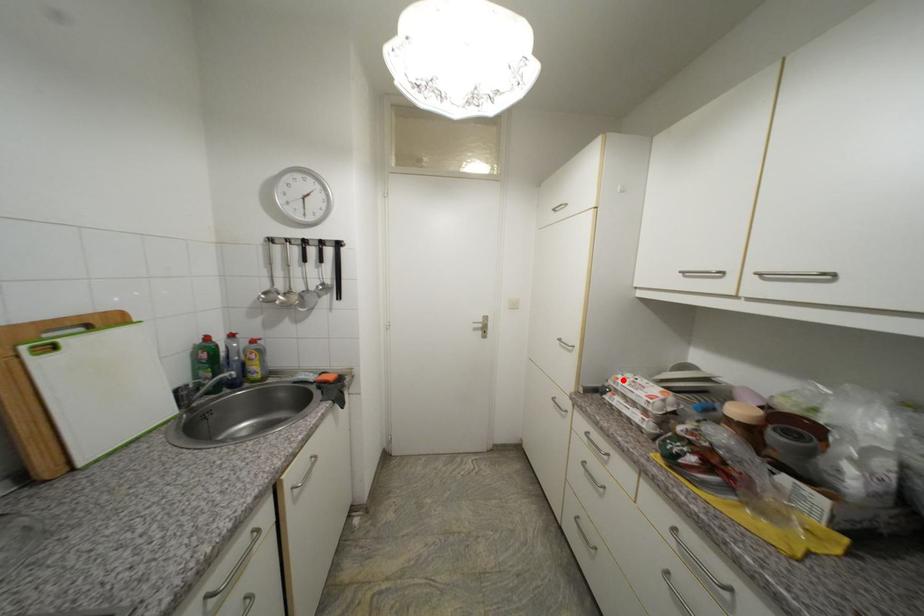
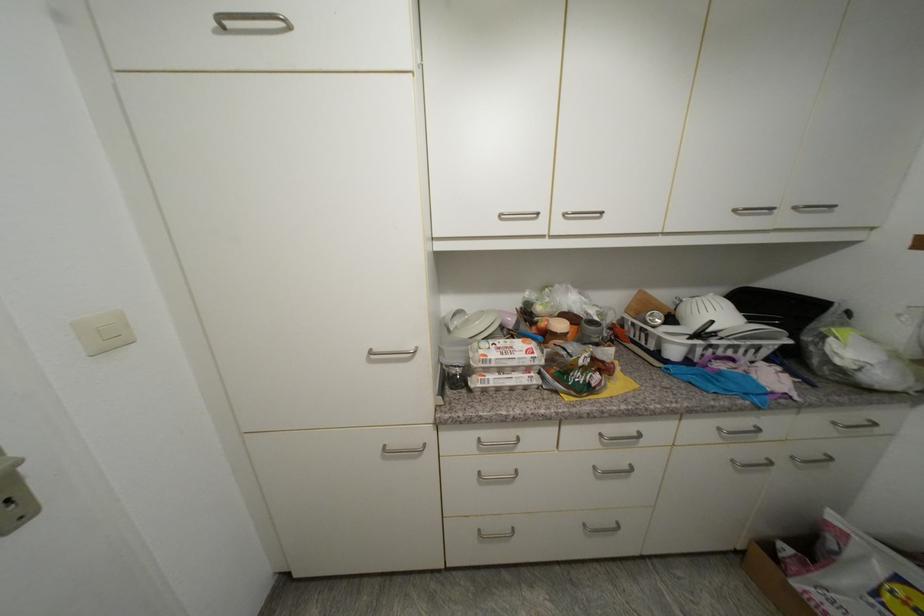
Find the pixel in the second image that matches the highlighted location in the first image.

(492, 357)